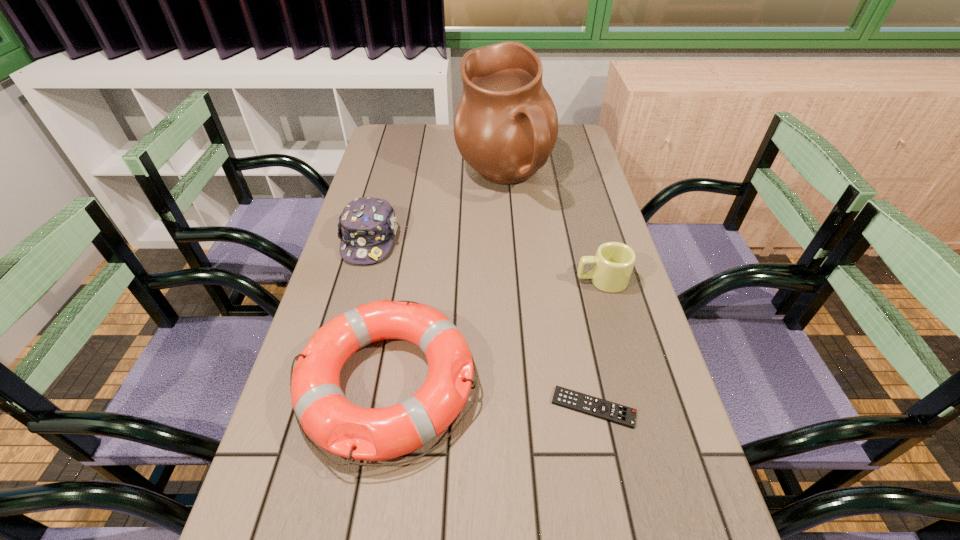
You are a GUI agent. You are given a task and a screenshot of the screen. Output one action in this format:
    pyautogui.click(x=<x>, y=<y>)
    Task: Click on the free space located with the handle on the side of the mug
    The height and width of the screenshot is (540, 960).
    Given the screenshot: What is the action you would take?
    [x=518, y=280]

You are a GUI agent. You are given a task and a screenshot of the screen. Output one action in this format:
    pyautogui.click(x=<x>, y=<y>)
    Task: Click on the free space located 0.260m with the handle on the side of the mug
    The height and width of the screenshot is (540, 960).
    Given the screenshot: What is the action you would take?
    pyautogui.click(x=476, y=280)

At what (x,y) coordinates should I click in order to perform the action: click on free spot located on the right of the life buoy. Please return your answer as a coordinate pair (x, y). Looking at the image, I should click on (506, 383).

Locate an element on the screen. The width and height of the screenshot is (960, 540). vacant region located 0.150m on the front of the remote control is located at coordinates (613, 511).

Image resolution: width=960 pixels, height=540 pixels. I want to click on object that is positioned at the far edge, so click(506, 125).

Identify the location of headwear located at the left edge. (367, 226).

In order to click on life buoy present at the left edge in this screenshot , I will do `click(322, 411)`.

You are a GUI agent. You are given a task and a screenshot of the screen. Output one action in this format:
    pyautogui.click(x=<x>, y=<y>)
    Task: Click on the cream pitcher positioned at the right edge
    The height and width of the screenshot is (540, 960).
    Given the screenshot: What is the action you would take?
    point(506,125)

At what (x,y) coordinates should I click in order to perform the action: click on mug that is at the right edge. Please return your answer as a coordinate pair (x, y). The image size is (960, 540). Looking at the image, I should click on (613, 263).

I want to click on remote control at the right edge, so [x=570, y=399].